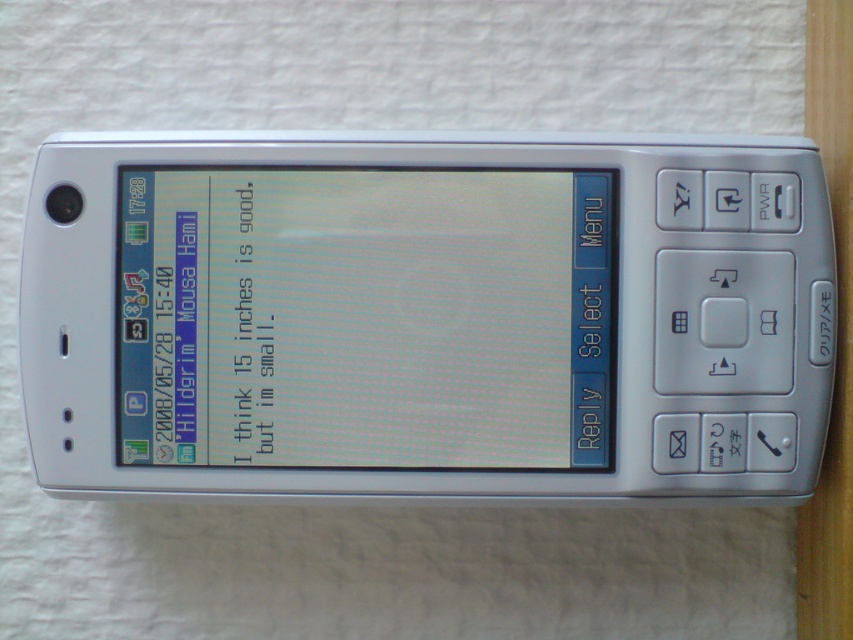
Does silver metallic phone at center appear on the left side of matte plastic screen at center?

Incorrect, silver metallic phone at center is not on the left side of matte plastic screen at center.

Is silver metallic phone at center bigger than matte plastic screen at center?

Indeed, silver metallic phone at center has a larger size compared to matte plastic screen at center.

You are a GUI agent. You are given a task and a screenshot of the screen. Output one action in this format:
    pyautogui.click(x=<x>, y=<y>)
    Task: Click on the silver metallic phone at center
    This screenshot has width=853, height=640.
    Given the screenshot: What is the action you would take?
    pos(426,316)